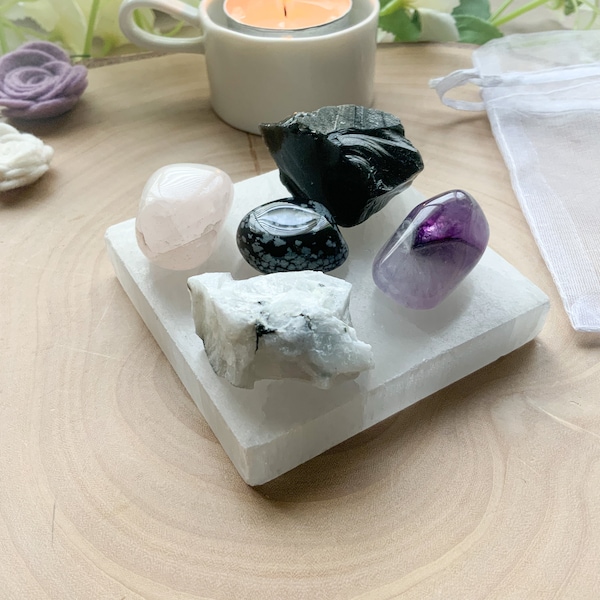
At what (x,y) coordinates should I click in order to perform the action: click on background plants. Please return your answer as a coordinate pair (x, y). Looking at the image, I should click on (440, 25), (108, 28).